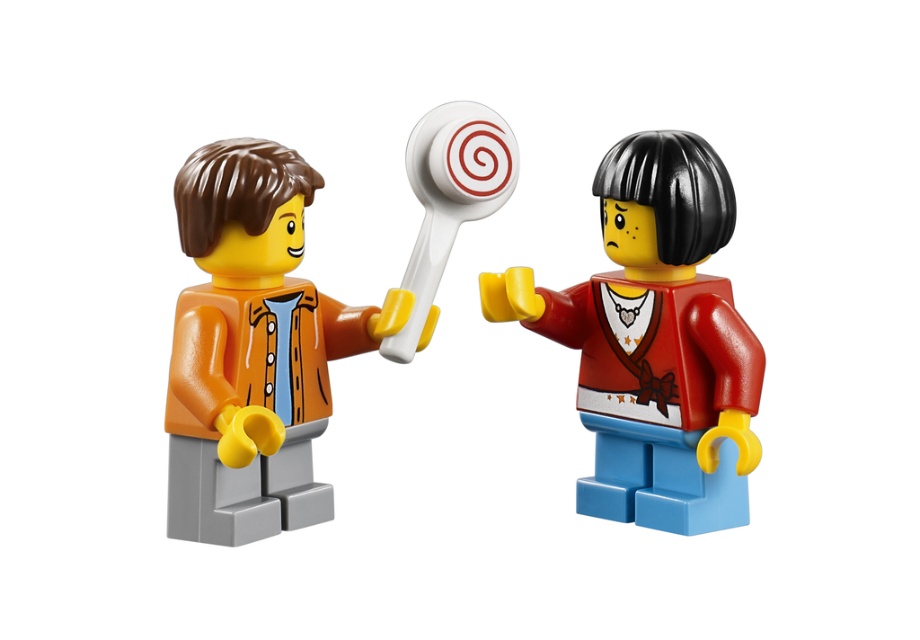
Who is lower down, smooth red sweater at center or white plastic lollipop at center?

smooth red sweater at center is below.

How distant is smooth red sweater at center from white plastic lollipop at center?

They are 6.12 inches apart.

Which is behind, point (719, 188) or point (483, 116)?

Point (719, 188)

You are a GUI agent. You are given a task and a screenshot of the screen. Output one action in this format:
    pyautogui.click(x=<x>, y=<y>)
    Task: Click on the smooth red sweater at center
    This screenshot has width=920, height=640.
    Given the screenshot: What is the action you would take?
    pyautogui.click(x=654, y=340)

Between smooth red sweater at center and matte orange shirt at left, which one is positioned lower?

smooth red sweater at center

Is smooth red sweater at center below matte orange shirt at left?

Indeed, smooth red sweater at center is positioned under matte orange shirt at left.

At what (x,y) coordinates should I click in order to perform the action: click on smooth red sweater at center. Please return your answer as a coordinate pair (x, y). Looking at the image, I should click on (654, 340).

Locate an element on the screen. This screenshot has width=920, height=640. smooth red sweater at center is located at coordinates (654, 340).

Does matte orange shirt at left have a larger size compared to white plastic lollipop at center?

Yes, matte orange shirt at left is bigger than white plastic lollipop at center.

Between matte orange shirt at left and white plastic lollipop at center, which one is positioned higher?

white plastic lollipop at center

Identify the location of matte orange shirt at left. The width and height of the screenshot is (920, 640). (253, 348).

You are a GUI agent. You are given a task and a screenshot of the screen. Output one action in this format:
    pyautogui.click(x=<x>, y=<y>)
    Task: Click on the matte orange shirt at left
    
    Given the screenshot: What is the action you would take?
    pyautogui.click(x=253, y=348)